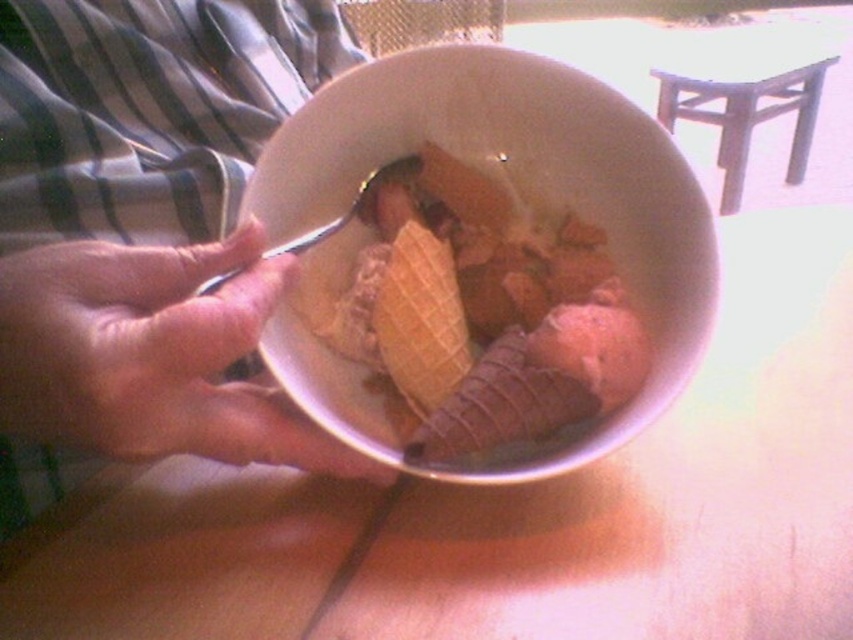
Does point (740, 26) come farther from viewer compared to point (456, 326)?

Yes, it is behind point (456, 326).

Is point (738, 186) positioned after point (462, 368)?

Yes, point (738, 186) is behind point (462, 368).

At what (x,y) coordinates should I click in order to perform the action: click on wooden stool at upper center. Please return your answer as a coordinate pair (x, y). Looking at the image, I should click on (743, 90).

Which is in front, point (15, 588) or point (317, 140)?

Point (15, 588) is more forward.

Can you confirm if wooden table at center is positioned to the right of white matte bowl at center?

Yes, wooden table at center is to the right of white matte bowl at center.

Image resolution: width=853 pixels, height=640 pixels. In order to click on wooden table at center in this screenshot , I will do `click(664, 490)`.

Does white matte bowl at center lie in front of waffle cone ice cream at center?

Yes, white matte bowl at center is in front of waffle cone ice cream at center.

Measure the distance between white matte bowl at center and waffle cone ice cream at center.

white matte bowl at center is 2.24 inches away from waffle cone ice cream at center.

Identify the location of white matte bowl at center. (520, 218).